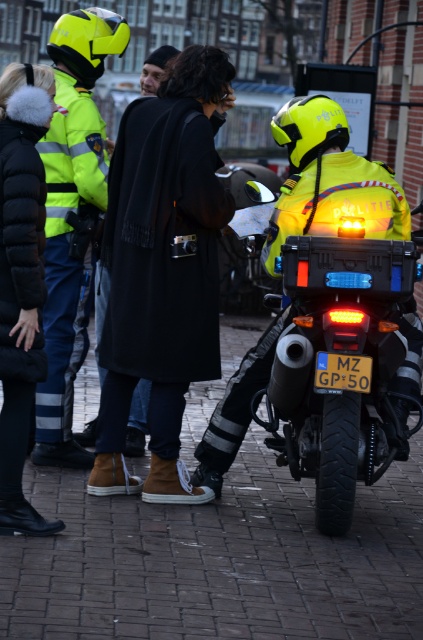
Who is positioned more to the left, neon yellow helmet at upper left or black wool coat at center?

neon yellow helmet at upper left

Is point (73, 348) farther from camera compared to point (153, 54)?

That is False.

At what (x,y) coordinates should I click in order to perform the action: click on neon yellow helmet at upper left. Please return your answer as a coordinate pair (x, y). Image resolution: width=423 pixels, height=640 pixels. Looking at the image, I should click on (71, 220).

Consider the image. Does neon yellow helmet at upper left appear under high-visibility yellow jacket at center?

Yes.

Does neon yellow helmet at upper left have a lesser height compared to high-visibility yellow jacket at center?

No.

Does point (55, 163) come in front of point (393, 220)?

No, it is behind (393, 220).

Where is `neon yellow helmet at upper left`? neon yellow helmet at upper left is located at coordinates (71, 220).

Is high-visibility yellow jacket at center wider than black wool coat at center?

Yes, high-visibility yellow jacket at center is wider than black wool coat at center.

From the picture: Can you confirm if high-visibility yellow jacket at center is shorter than black wool coat at center?

Incorrect, high-visibility yellow jacket at center's height does not fall short of black wool coat at center's.

Image resolution: width=423 pixels, height=640 pixels. What are the coordinates of `high-visibility yellow jacket at center` in the screenshot? It's located at (329, 180).

Locate an element on the screen. high-visibility yellow jacket at center is located at coordinates (329, 180).